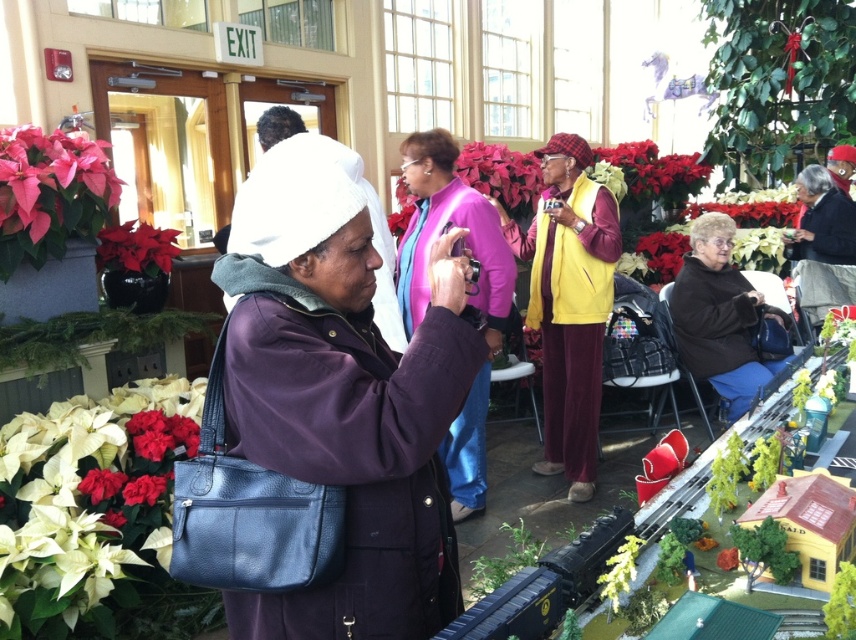
Question: Is white matte flower at lower left bigger than matte red flower at lower left?

Choices:
 (A) no
 (B) yes

Answer: (B)

Question: Is poinsettia leaf at left smaller than green matte plant at lower right?

Choices:
 (A) no
 (B) yes

Answer: (A)

Question: Which object is the farthest from the poinsettia leaf at left?

Choices:
 (A) black leather jacket at right
 (B) matte black purse at center

Answer: (A)

Question: Among these objects, which one is nearest to the camera?

Choices:
 (A) yellow fabric vest at center
 (B) black leather jacket at right
 (C) green matte plant at lower center

Answer: (C)

Question: Is matte black purse at center further to the viewer compared to red velvet poinsettia at upper center?

Choices:
 (A) no
 (B) yes

Answer: (A)

Question: Which object is closer to the camera taking this photo?

Choices:
 (A) white matte flower at lower left
 (B) poinsettia leaf at center
 (C) poinsettia leaf at left

Answer: (A)